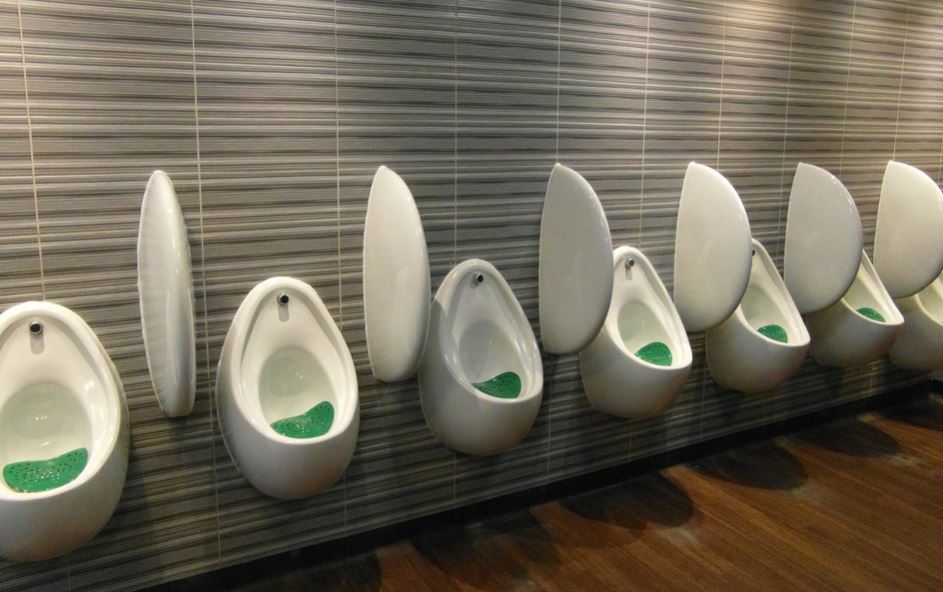
Image resolution: width=943 pixels, height=592 pixels. I want to click on urinals, so click(52, 415), click(292, 386), click(490, 342), click(643, 318), click(759, 307), click(861, 291), click(928, 298).